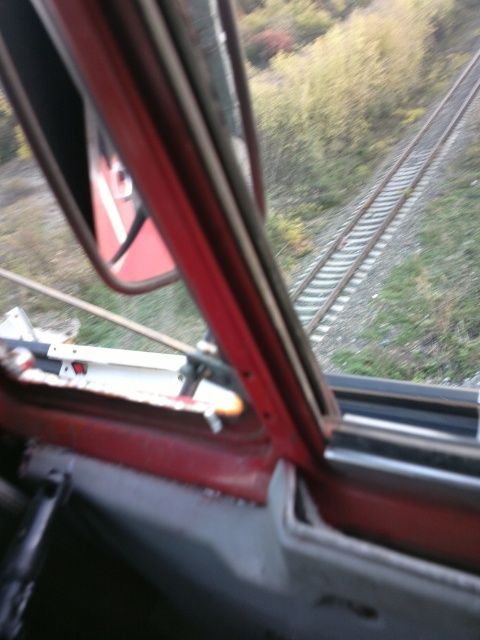
Question: Can you confirm if metallic silver train window at center is positioned below metal/smooth track at center?

Choices:
 (A) no
 (B) yes

Answer: (B)

Question: Which point is closer to the camera?

Choices:
 (A) metal/smooth track at center
 (B) metallic silver train window at center

Answer: (B)

Question: Which point is closer to the camera?

Choices:
 (A) (359, 278)
 (B) (192, 353)

Answer: (B)

Question: Is metallic silver train window at center bigger than metal/smooth track at center?

Choices:
 (A) no
 (B) yes

Answer: (A)

Question: Does metallic silver train window at center appear over metal/smooth track at center?

Choices:
 (A) yes
 (B) no

Answer: (B)